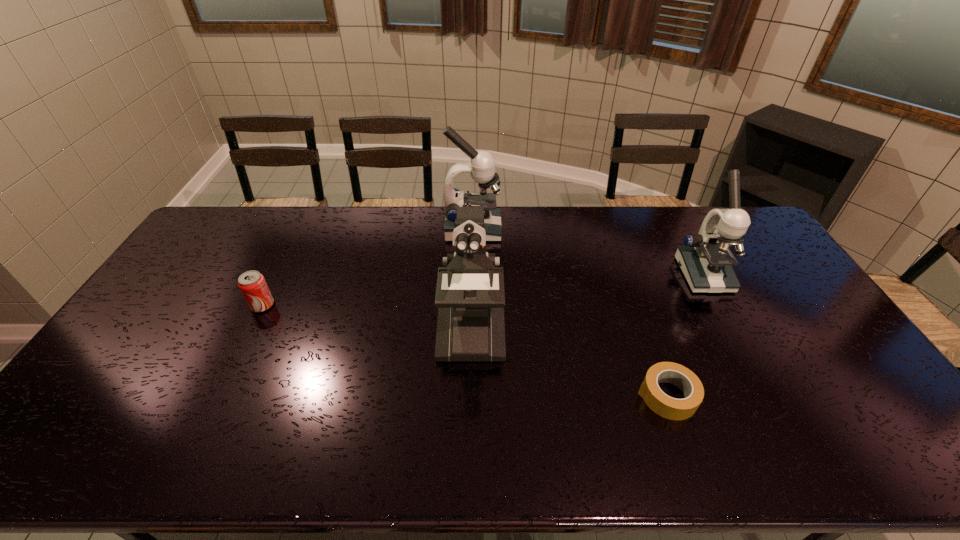
Locate an element on the screen. the farthest object is located at coordinates (481, 166).

Locate an element on the screen. the rightmost microscope is located at coordinates (705, 259).

Where is `soda can`? The image size is (960, 540). soda can is located at coordinates (252, 284).

I want to click on the fourth tallest object, so click(252, 284).

You are a GUI agent. You are given a task and a screenshot of the screen. Output one action in this format:
    pyautogui.click(x=<x>, y=<y>)
    Task: Click on the shortest object
    This screenshot has width=960, height=540.
    Given the screenshot: What is the action you would take?
    pyautogui.click(x=667, y=407)

The height and width of the screenshot is (540, 960). I want to click on the second object from right to left, so click(x=667, y=407).

Locate an element on the screen. vacant space located 0.150m on the right of the farthest object is located at coordinates (541, 230).

Locate an element on the screen. This screenshot has width=960, height=540. free space located at the eyepiece of the rightmost object is located at coordinates (766, 390).

The height and width of the screenshot is (540, 960). I want to click on vacant region located on the left of the leftmost object, so pos(154,305).

Identify the location of vacant space located 0.220m at the edge of the nearest object. Image resolution: width=960 pixels, height=540 pixels. (552, 396).